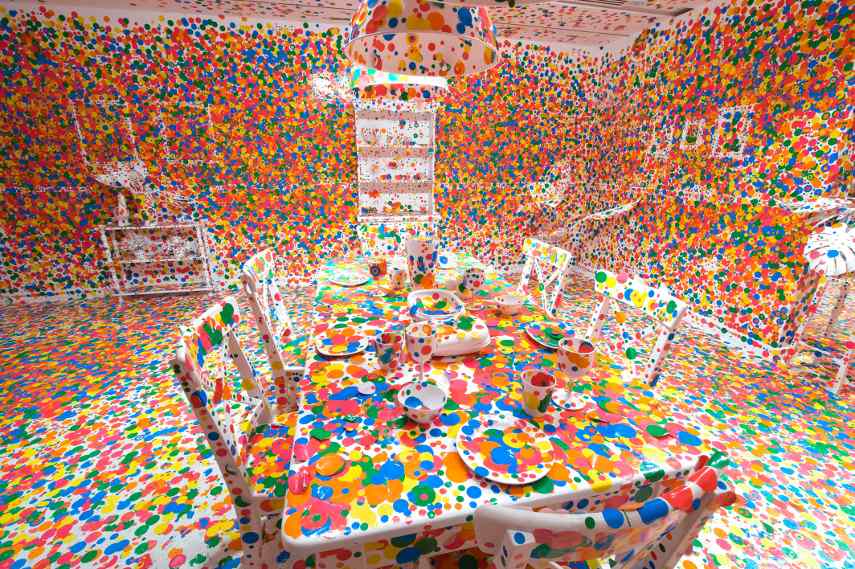
In order to click on shelf in this screenshot , I will do `click(191, 257)`.